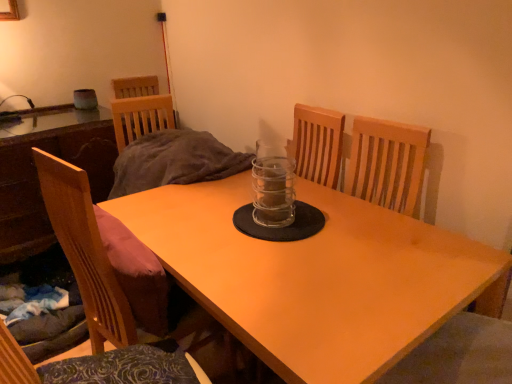
Question: Can you confirm if light brown wooden table at center, the first table from the right, is thinner than transparent glass jar at center?

Choices:
 (A) yes
 (B) no

Answer: (B)

Question: Is light brown wooden table at center, which is the second table from left to right, shorter than transparent glass jar at center?

Choices:
 (A) no
 (B) yes

Answer: (A)

Question: Is light brown wooden table at center, the first table from the right, not inside transparent glass jar at center?

Choices:
 (A) no
 (B) yes

Answer: (B)

Question: Can you confirm if light brown wooden table at center, which is the second table from left to right, is wider than transparent glass jar at center?

Choices:
 (A) no
 (B) yes

Answer: (B)

Question: Does light brown wooden table at center, the first table from the right, have a larger size compared to transparent glass jar at center?

Choices:
 (A) yes
 (B) no

Answer: (A)

Question: Is the surface of wooden chair at left in direct contact with wooden table at left, which is the second table in right-to-left order?

Choices:
 (A) yes
 (B) no

Answer: (B)

Question: Does wooden chair at left have a greater height compared to wooden table at left, which is the second table in right-to-left order?

Choices:
 (A) no
 (B) yes

Answer: (B)

Question: Is wooden chair at left positioned before wooden table at left, the first table in the left-to-right sequence?

Choices:
 (A) no
 (B) yes

Answer: (B)

Question: Is wooden table at left, which is the second table in right-to-left order, surrounded by wooden chair at left?

Choices:
 (A) no
 (B) yes

Answer: (A)

Question: Does wooden chair at left have a smaller size compared to wooden table at left, which is the second table in right-to-left order?

Choices:
 (A) yes
 (B) no

Answer: (A)

Question: Is wooden chair at left positioned behind wooden table at left, the first table in the left-to-right sequence?

Choices:
 (A) no
 (B) yes

Answer: (A)

Question: Is light brown wooden table at center, which is the second table from left to right, completely or partially inside wooden table at left, the first table in the left-to-right sequence?

Choices:
 (A) no
 (B) yes

Answer: (A)